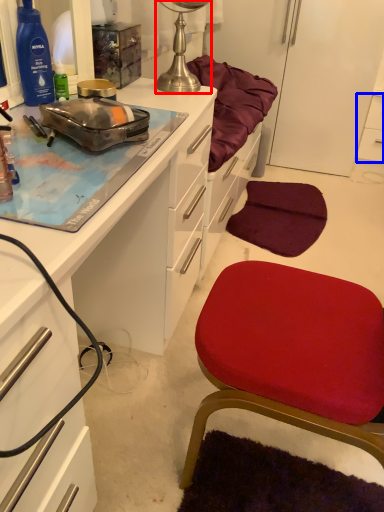
Question: Which object appears closest to the camera in this image, lamp (highlighted by a red box) or cabinetry (highlighted by a blue box)?

Choices:
 (A) lamp
 (B) cabinetry

Answer: (A)